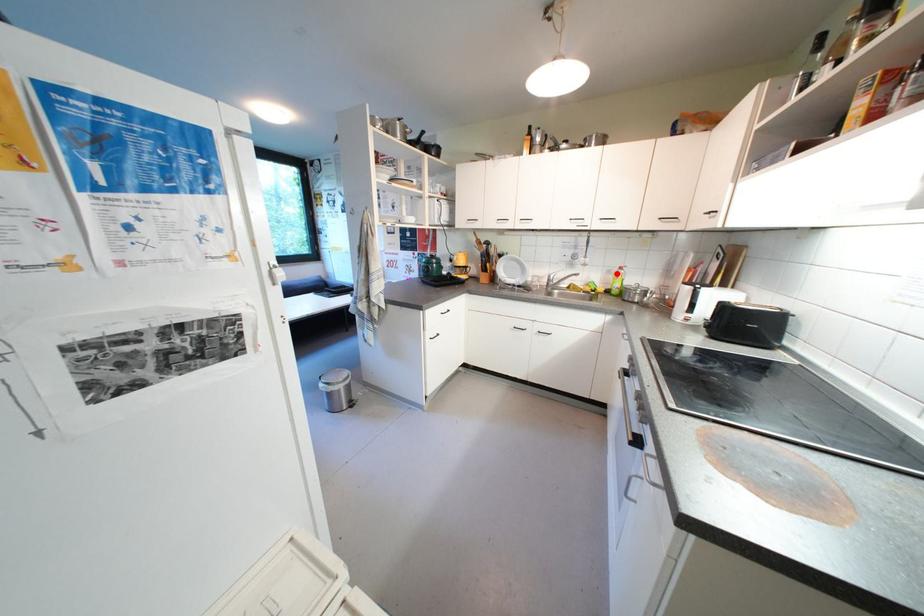
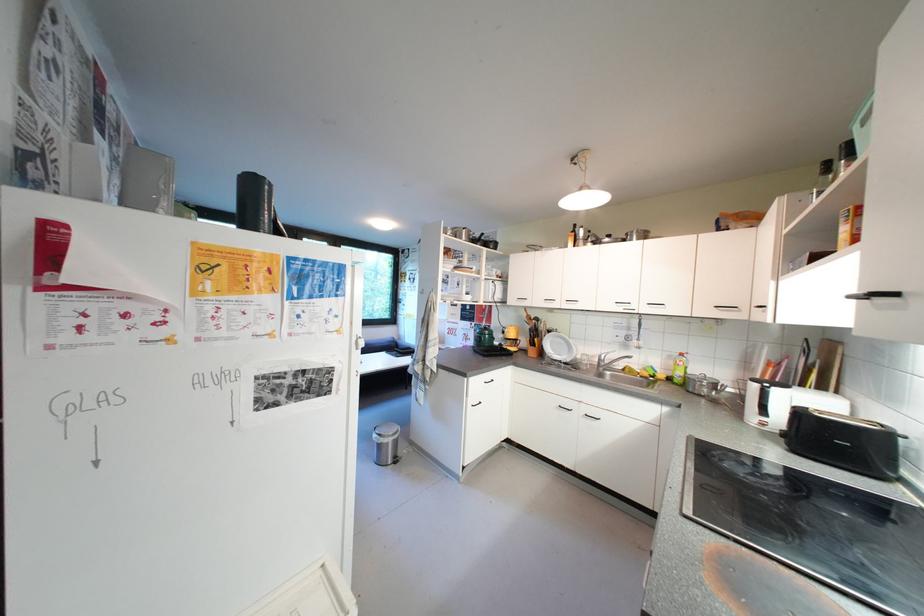
Question: I am providing you with two images of the same scene from different viewpoints. A red point is shown in image1. For the corresponding object point in image2, is it positioned nearer or farther from the camera?

Choices:
 (A) Nearer
 (B) Farther

Answer: (B)